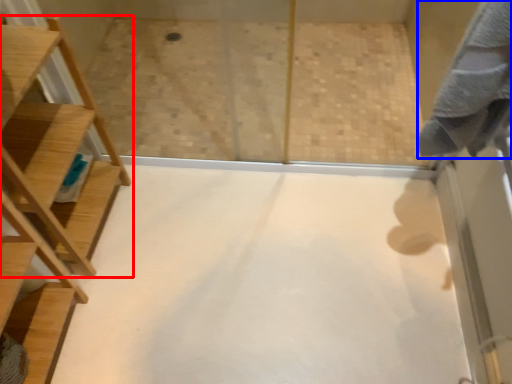
Question: Which point is closer to the camera, furniture (highlighted by a red box) or bath towel (highlighted by a blue box)?

Choices:
 (A) furniture
 (B) bath towel

Answer: (B)